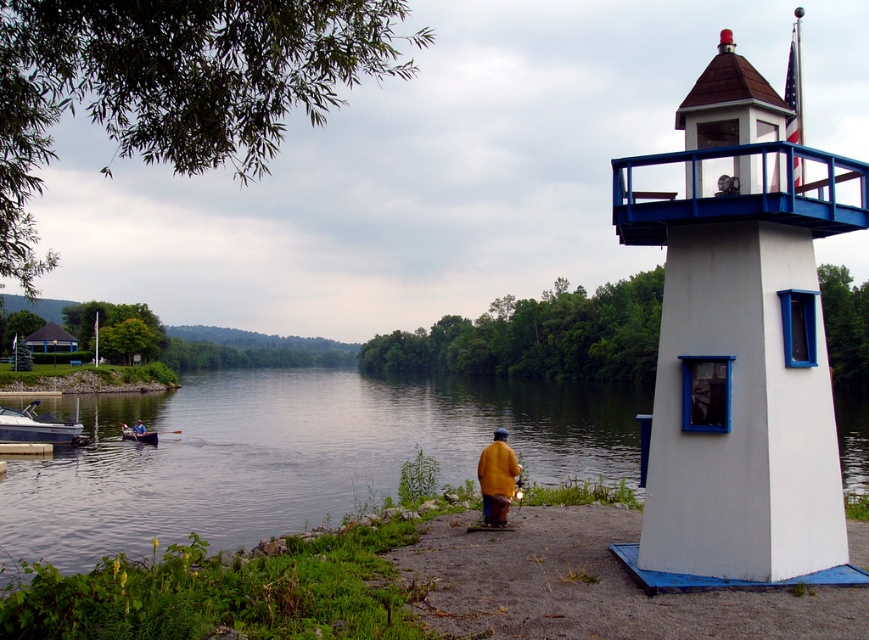
Question: Does wooden canoe at left appear over yellow matte jacket at lower center?

Choices:
 (A) yes
 (B) no

Answer: (A)

Question: Does white painted wood lighthouse at right appear under white glossy boat at left?

Choices:
 (A) no
 (B) yes

Answer: (A)

Question: Which is farther from the smooth water at center?

Choices:
 (A) white glossy boat at left
 (B) white painted wood lighthouse at right
 (C) yellow matte jacket at center
 (D) yellow matte jacket at lower center

Answer: (C)

Question: Which point is farther to the camera?

Choices:
 (A) smooth water at center
 (B) yellow matte jacket at center
 (C) wooden canoe at left

Answer: (C)

Question: Is yellow matte jacket at center wider than wooden canoe at left?

Choices:
 (A) no
 (B) yes

Answer: (A)

Question: Which object is the farthest from the white glossy boat at left?

Choices:
 (A) yellow matte jacket at center
 (B) white painted wood lighthouse at right
 (C) yellow matte jacket at lower center

Answer: (B)